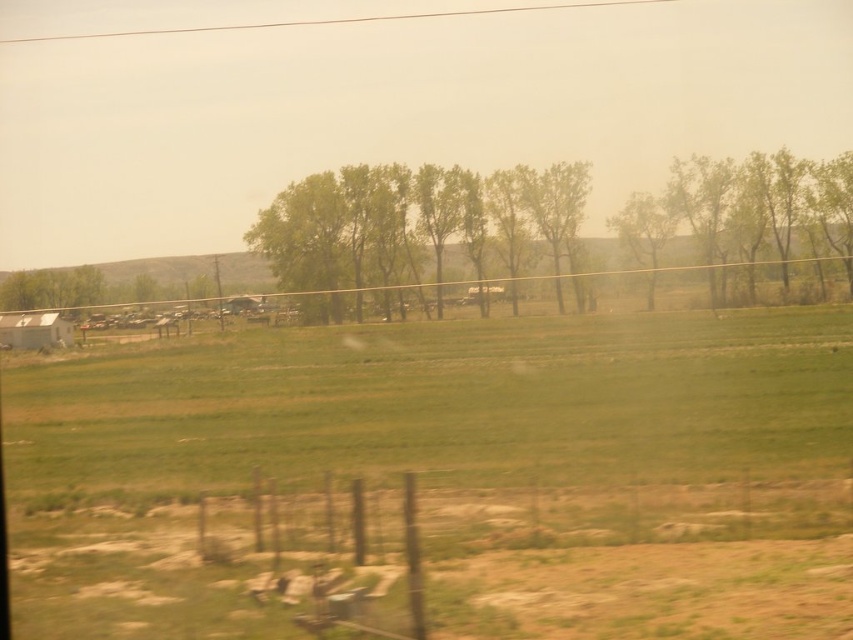
Question: Is green leafy trees at center below green leafy tree at center?

Choices:
 (A) yes
 (B) no

Answer: (A)

Question: Can you confirm if rusty wire fence at lower center is wider than green leafy trees at center?

Choices:
 (A) no
 (B) yes

Answer: (A)

Question: Considering the real-world distances, which object is farthest from the green leafy trees at center?

Choices:
 (A) rusty wire fence at lower center
 (B) green leafy tree at center

Answer: (A)

Question: Based on their relative distances, which object is farther from the green leafy trees at center?

Choices:
 (A) green leafy tree at center
 (B) rusty wire fence at lower center

Answer: (B)

Question: Is green leafy trees at center smaller than green leafy tree at center?

Choices:
 (A) no
 (B) yes

Answer: (A)

Question: Which of the following is the farthest from the observer?

Choices:
 (A) green leafy tree at center
 (B) rusty wire fence at lower center
 (C) green leafy trees at center

Answer: (A)